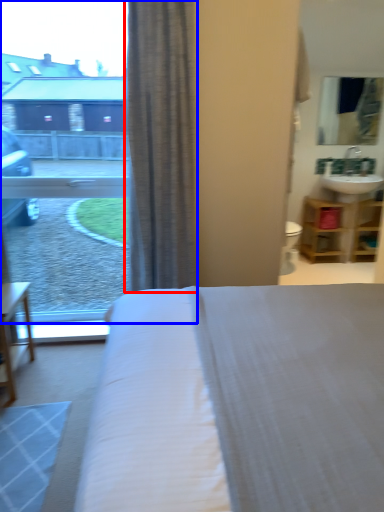
Question: Which of the following is the closest to the observer, curtain (highlighted by a red box) or window (highlighted by a blue box)?

Choices:
 (A) curtain
 (B) window

Answer: (A)